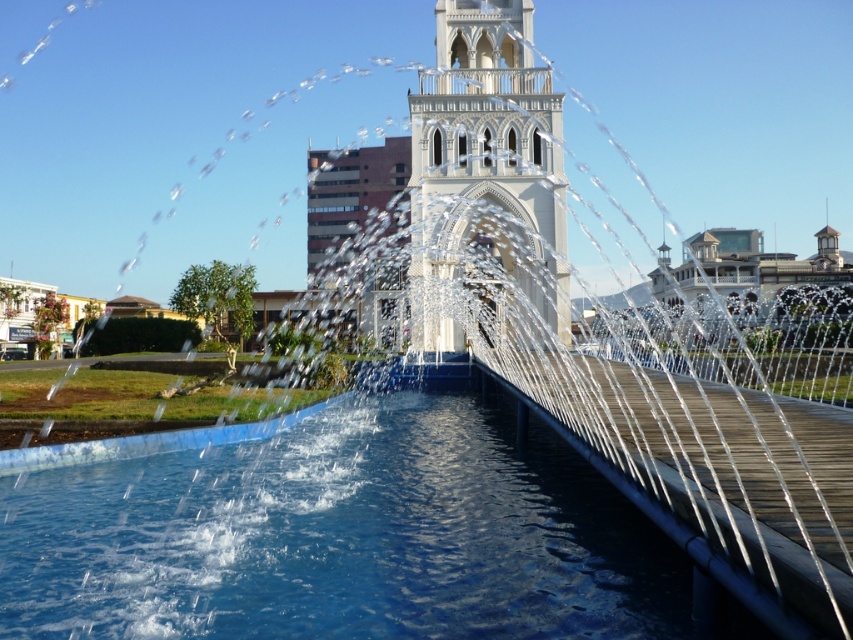
Does transparent blue water at center have a greater width compared to white stone tower at center?

Correct, the width of transparent blue water at center exceeds that of white stone tower at center.

Does point (497, 564) come in front of point (479, 92)?

That is True.

Find the location of a particular element. transparent blue water at center is located at coordinates (346, 538).